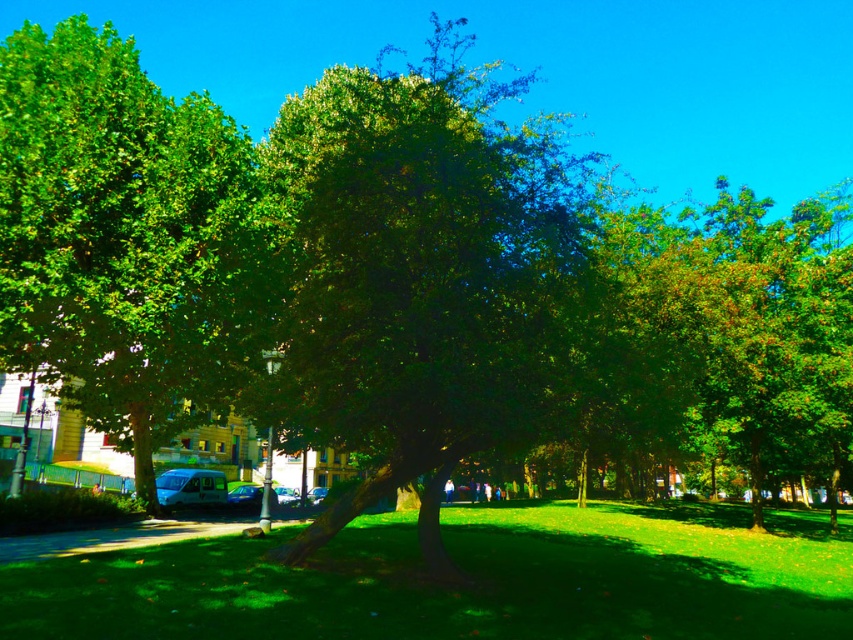
You are a gardener who wants to mow the green grassy at center. However, there is a metallic silver car at center in the way. Can you mow the grassy area without moving the car?

The green grassy at center is positioned over the metallic silver car at center, meaning the car is beneath the grassy area. Since the car is blocking the grass, you cannot mow the green grassy at center without moving the metallic silver car at center.

You are a photographer planning to capture the green leafy tree at center and the metallic silver van at lower left in the same frame. Based on their sizes in the image, which object would appear more prominent in your photo?

The green leafy tree at center would appear more prominent in the photo because it has a larger size compared to the metallic silver van at lower left.